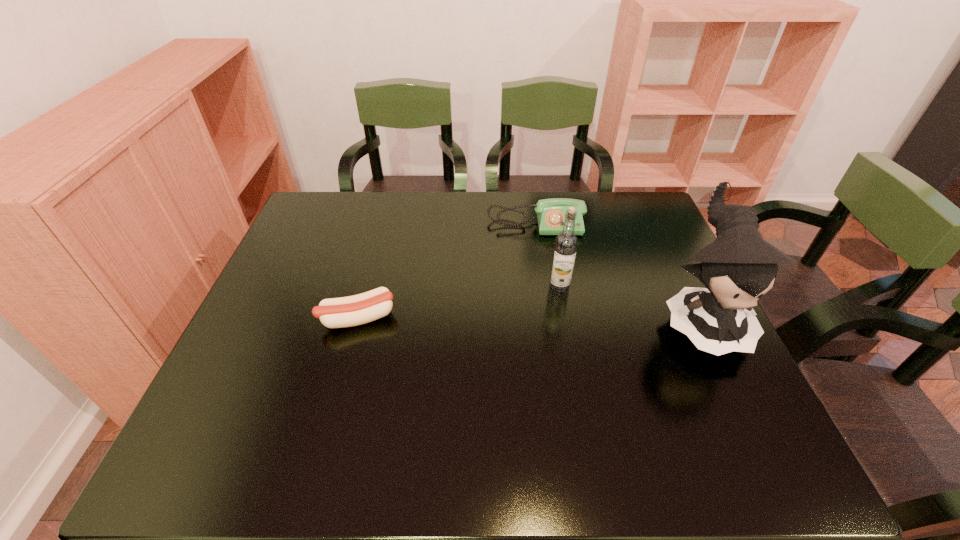
Where is `the shortest object`? the shortest object is located at coordinates (366, 307).

Where is `the leftmost object`? This screenshot has width=960, height=540. the leftmost object is located at coordinates (366, 307).

Locate an element on the screen. The width and height of the screenshot is (960, 540). doll is located at coordinates (739, 266).

What are the coordinates of `the tallest object` in the screenshot? It's located at (739, 266).

Where is `the farthest object`? the farthest object is located at coordinates (551, 212).

Where is `the second shortest object`? The image size is (960, 540). the second shortest object is located at coordinates (551, 212).

Locate an element on the screen. This screenshot has height=540, width=960. vodka is located at coordinates (566, 242).

Identify the location of vacant space located 0.110m on the right of the shortest object. (439, 318).

Identify the location of free location located at the face of the doll. The height and width of the screenshot is (540, 960). (739, 401).

This screenshot has width=960, height=540. In order to click on free spot located on the dial of the third tallest object in this screenshot , I will do `click(540, 266)`.